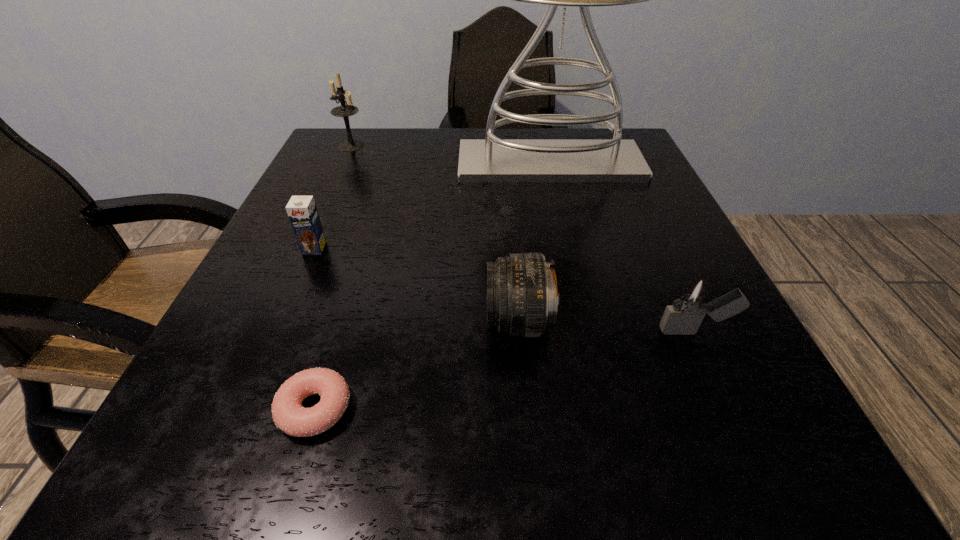
Locate an element on the screen. This screenshot has height=540, width=960. doughnut at the left edge is located at coordinates (288, 414).

The width and height of the screenshot is (960, 540). Identify the location of table lamp that is at the right edge. (491, 160).

The width and height of the screenshot is (960, 540). In order to click on igniter that is positioned at the right edge in this screenshot , I will do `click(690, 303)`.

You are a GUI agent. You are given a task and a screenshot of the screen. Output one action in this format:
    pyautogui.click(x=<x>, y=<y>)
    Task: Click on the object located at the far left corner
    The image size is (960, 540).
    Given the screenshot: What is the action you would take?
    pyautogui.click(x=345, y=110)

Where is `object present at the near left corner`? This screenshot has height=540, width=960. object present at the near left corner is located at coordinates (288, 414).

Find the location of a particular element. This screenshot has width=960, height=540. object that is at the far right corner is located at coordinates (491, 160).

The width and height of the screenshot is (960, 540). I want to click on free spot at the far edge of the desktop, so click(411, 173).

The height and width of the screenshot is (540, 960). Identify the location of vacant space at the near edge. (473, 464).

In the image, there is a desktop. Identify the location of vacant space at the left edge. The height and width of the screenshot is (540, 960). (284, 224).

This screenshot has height=540, width=960. Identify the location of vacant space at the right edge. (624, 207).